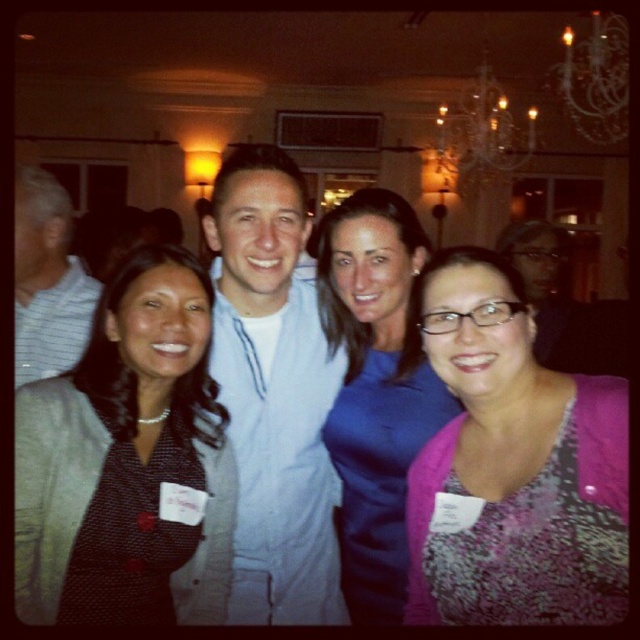
Question: Which point is farther to the camera?

Choices:
 (A) blue satin dress at center
 (B) matte light blue shirt at center
 (C) matte black dress at center
 (D) light blue shirt at center

Answer: (B)

Question: Which point is closer to the camera taking this photo?

Choices:
 (A) (451, 406)
 (B) (480, 298)
 (C) (40, 243)

Answer: (B)

Question: Which object is farther from the camera taking this photo?

Choices:
 (A) matte light blue shirt at center
 (B) matte black dress at center
 (C) blue satin dress at center
 (D) pink textured sweater at lower right

Answer: (A)

Question: Considering the relative positions of light blue shirt at center and blue satin dress at center in the image provided, where is light blue shirt at center located with respect to blue satin dress at center?

Choices:
 (A) above
 (B) below

Answer: (A)

Question: Does blue satin dress at center appear over matte light blue shirt at center?

Choices:
 (A) yes
 (B) no

Answer: (B)

Question: Can you confirm if pink textured sweater at lower right is positioned below matte light blue shirt at center?

Choices:
 (A) no
 (B) yes

Answer: (B)